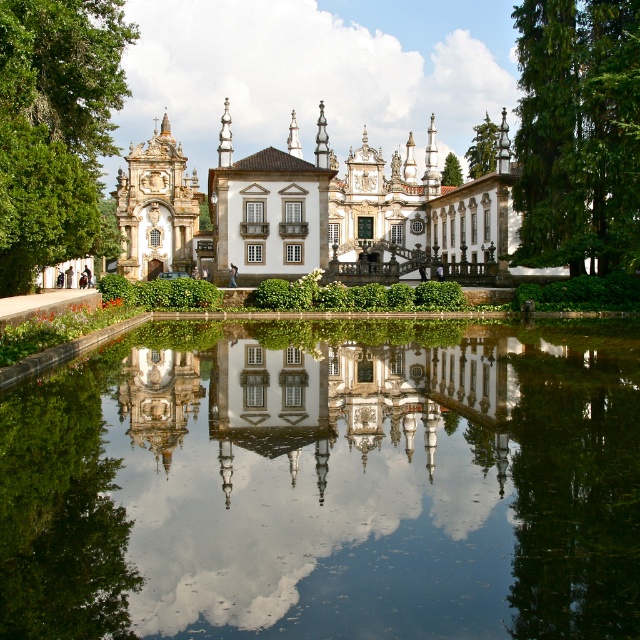
You are standing on the walkway in front of the white stone palace at center and the green leafy tree at center. Which object is closer to you?

The white stone palace at center is closer to you than the green leafy tree at center because it is positioned in front of it.

From the picture: You are standing at the center of the image. Which direction should you look to see the green leafy tree at left?

The green leafy tree at left is located at point [54,128], so you should look to your left to see it.

You are an architect analyzing the symmetry of the building. You notice the clear glass water at center and the green leafy tree at left in the scene. Which object appears shorter when viewed from the front of the building?

The clear glass water at center appears shorter than the green leafy tree at left because it has a lesser height compared to the tree.